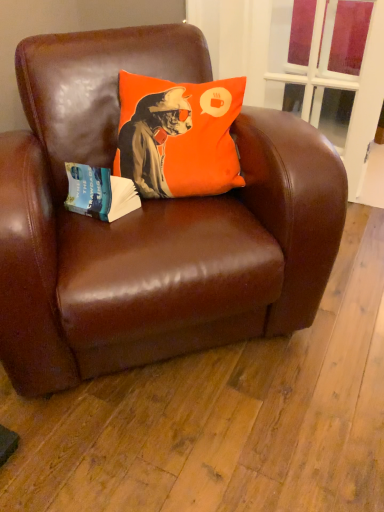
Question: Is brown leather chair at center closer to the viewer compared to transparent glass window at upper center?

Choices:
 (A) no
 (B) yes

Answer: (B)

Question: Is brown leather chair at center far away from transparent glass window at upper center?

Choices:
 (A) yes
 (B) no

Answer: (A)

Question: Does brown leather chair at center come behind transparent glass window at upper center?

Choices:
 (A) no
 (B) yes

Answer: (A)

Question: Can you confirm if brown leather chair at center is shorter than transparent glass window at upper center?

Choices:
 (A) yes
 (B) no

Answer: (A)

Question: Is transparent glass window at upper center located within brown leather chair at center?

Choices:
 (A) no
 (B) yes

Answer: (A)

Question: Is orange fabric pillow at upper center taller or shorter than brown leather chair at center?

Choices:
 (A) short
 (B) tall

Answer: (A)

Question: Is orange fabric pillow at upper center inside the boundaries of brown leather chair at center, or outside?

Choices:
 (A) outside
 (B) inside

Answer: (B)

Question: Relative to brown leather chair at center, is orange fabric pillow at upper center in front or behind?

Choices:
 (A) behind
 (B) front

Answer: (A)

Question: From a real-world perspective, is orange fabric pillow at upper center positioned above or below brown leather chair at center?

Choices:
 (A) above
 (B) below

Answer: (A)

Question: Is orange fabric pillow at upper center taller or shorter than blue paper at left?

Choices:
 (A) short
 (B) tall

Answer: (B)

Question: Considering the positions of orange fabric pillow at upper center and blue paper at left in the image, is orange fabric pillow at upper center wider or thinner than blue paper at left?

Choices:
 (A) thin
 (B) wide

Answer: (B)

Question: Would you say orange fabric pillow at upper center is to the left or to the right of blue paper at left in the picture?

Choices:
 (A) left
 (B) right

Answer: (B)

Question: Based on their sizes in the image, would you say orange fabric pillow at upper center is bigger or smaller than blue paper at left?

Choices:
 (A) big
 (B) small

Answer: (A)

Question: From a real-world perspective, is brown leather chair at center above or below transparent glass window at upper center?

Choices:
 (A) above
 (B) below

Answer: (B)

Question: Visually, is brown leather chair at center positioned to the left or to the right of transparent glass window at upper center?

Choices:
 (A) right
 (B) left

Answer: (B)